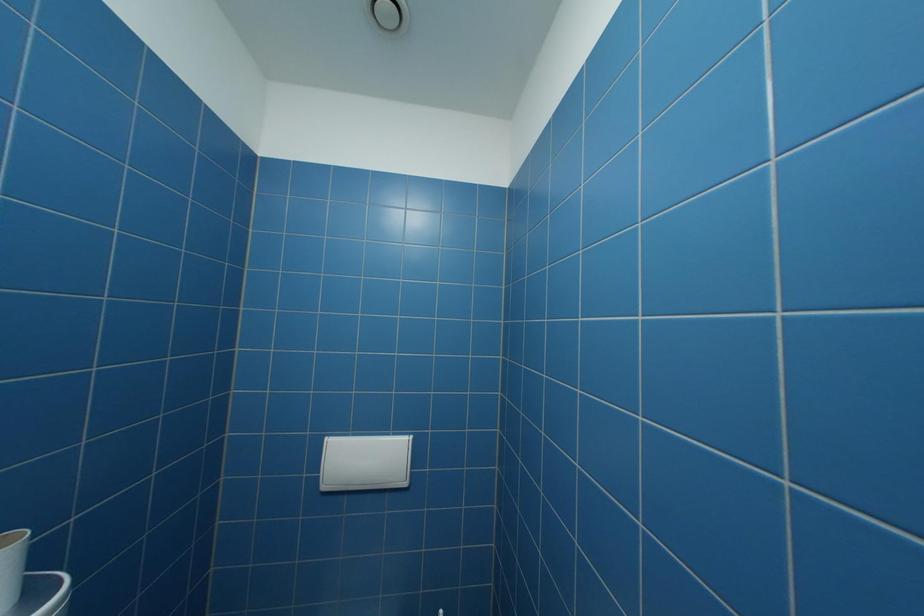
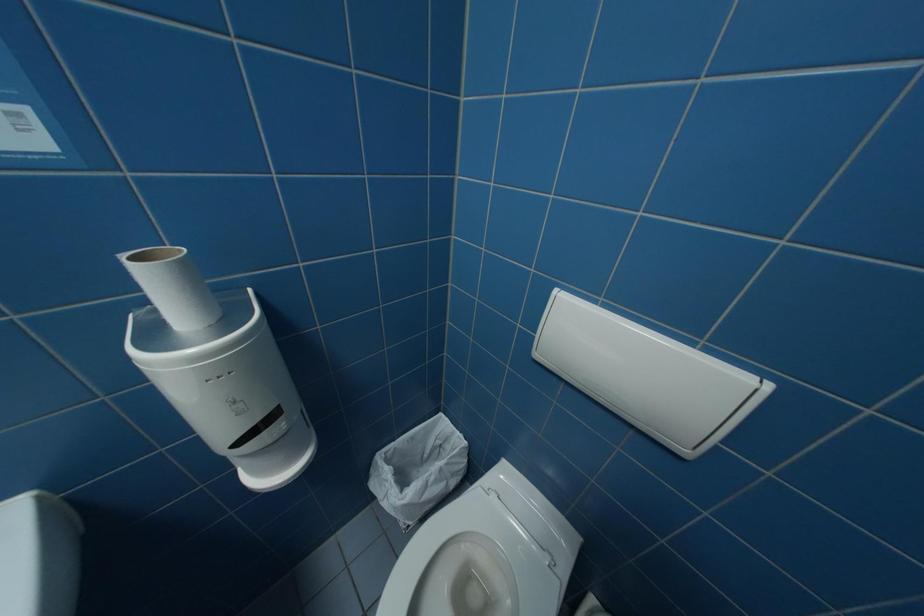
How did the camera likely rotate?

The camera's rotation is toward left-down.